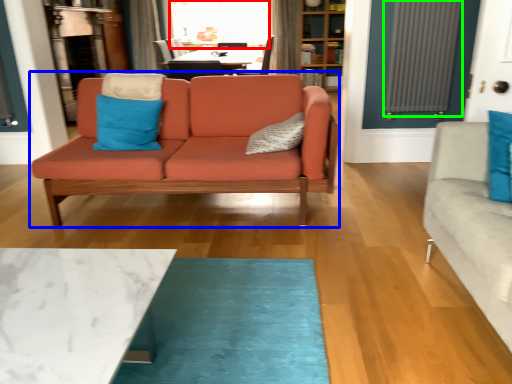
Question: Estimate the real-world distances between objects in this image. Which object is farther from window screen (highlighted by a red box), studio couch (highlighted by a blue box) or radiator (highlighted by a green box)?

Choices:
 (A) studio couch
 (B) radiator

Answer: (A)